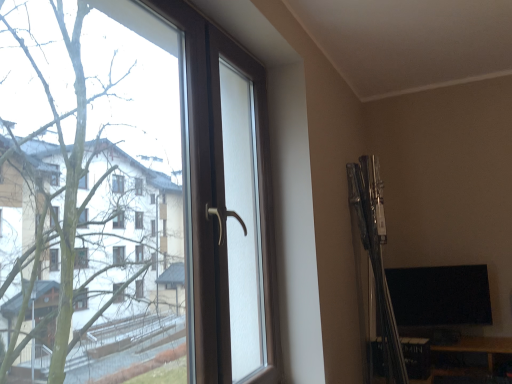
What are the coordinates of `brown plastic window at left` in the screenshot? It's located at [x=131, y=194].

In order to face brown plastic window at left, should I rotate leftwards or rightwards?

Rotate your view left by about 9.914°.

The width and height of the screenshot is (512, 384). What do you see at coordinates (131, 194) in the screenshot? I see `brown plastic window at left` at bounding box center [131, 194].

Identify the location of black glossy monitor at lower right. (440, 295).

What do you see at coordinates (440, 295) in the screenshot?
I see `black glossy monitor at lower right` at bounding box center [440, 295].

Locate an element on the screen. The image size is (512, 384). brown plastic window at left is located at coordinates [131, 194].

Is black glossy monitor at lower right to the right of brown plastic window at left from the viewer's perspective?

Indeed, black glossy monitor at lower right is positioned on the right side of brown plastic window at left.

Is black glossy monitor at lower right positioned behind brown plastic window at left?

Yes, black glossy monitor at lower right is behind brown plastic window at left.

Which is closer, (446, 316) or (124, 137)?

Positioned in front is point (124, 137).

Consider the image. From the image's perspective, who appears lower, black glossy monitor at lower right or brown plastic window at left?

black glossy monitor at lower right.

From a real-world perspective, which is physically below, black glossy monitor at lower right or brown plastic window at left?

black glossy monitor at lower right.

Which object is wider, black glossy monitor at lower right or brown plastic window at left?

Wider between the two is brown plastic window at left.

Does black glossy monitor at lower right have a greater height compared to brown plastic window at left?

Incorrect, the height of black glossy monitor at lower right is not larger of that of brown plastic window at left.

Who is bigger, black glossy monitor at lower right or brown plastic window at left?

Bigger between the two is brown plastic window at left.

Is black glossy monitor at lower right outside of brown plastic window at left?

Indeed, black glossy monitor at lower right is completely outside brown plastic window at left.

Is black glossy monitor at lower right far from brown plastic window at left?

black glossy monitor at lower right is positioned a significant distance from brown plastic window at left.

Is black glossy monitor at lower right facing towards brown plastic window at left?

No, black glossy monitor at lower right is not aimed at brown plastic window at left.

This screenshot has height=384, width=512. Identify the location of window lying on the left of black glossy monitor at lower right. (131, 194).

Is brown plastic window at left at the right side of black glossy monitor at lower right?

No.

Which object is closer to the camera, brown plastic window at left or black glossy monitor at lower right?

Positioned in front is brown plastic window at left.

Is point (78, 322) farther from viewer compared to point (439, 292)?

No, (78, 322) is in front of (439, 292).

From the image's perspective, does brown plastic window at left appear lower than black glossy monitor at lower right?

Incorrect, from the image's perspective, brown plastic window at left is higher than black glossy monitor at lower right.

From a real-world perspective, is brown plastic window at left on top of black glossy monitor at lower right?

Yes, from a real-world perspective, brown plastic window at left is on top of black glossy monitor at lower right.

Can you confirm if brown plastic window at left is wider than black glossy monitor at lower right?

Indeed, brown plastic window at left has a greater width compared to black glossy monitor at lower right.

Does brown plastic window at left have a greater height compared to black glossy monitor at lower right?

Yes.

Which of these two, brown plastic window at left or black glossy monitor at lower right, is smaller?

Smaller between the two is black glossy monitor at lower right.

Is brown plastic window at left not within black glossy monitor at lower right?

Absolutely, brown plastic window at left is external to black glossy monitor at lower right.

Are brown plastic window at left and black glossy monitor at lower right making contact?

brown plastic window at left and black glossy monitor at lower right are clearly separated.

Could you tell me if brown plastic window at left is turned towards black glossy monitor at lower right?

No, brown plastic window at left is not oriented towards black glossy monitor at lower right.

Looking at this image, how many degrees apart are the facing directions of brown plastic window at left and black glossy monitor at lower right?

The angular difference between brown plastic window at left and black glossy monitor at lower right is 69.2 degrees.

How distant is brown plastic window at left from black glossy monitor at lower right?

1.58 meters.

In the image, there is a black glossy monitor at lower right. Identify the location of window above it (from the image's perspective). (131, 194).

Locate an element on the screen. Image resolution: width=512 pixels, height=384 pixels. window above the black glossy monitor at lower right (from the image's perspective) is located at coordinates (131, 194).

This screenshot has width=512, height=384. Identify the location of computer monitor on the right of brown plastic window at left. (440, 295).